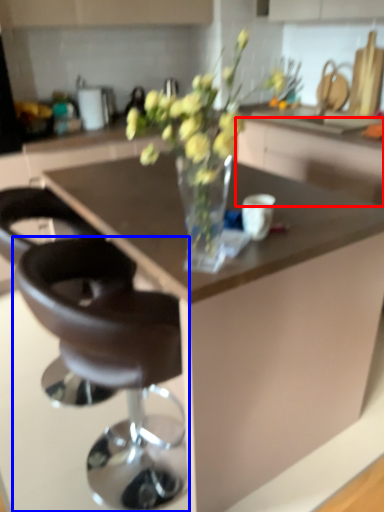
Question: Which object is closer to the camera taking this photo, cabinetry (highlighted by a red box) or chair (highlighted by a blue box)?

Choices:
 (A) cabinetry
 (B) chair

Answer: (B)